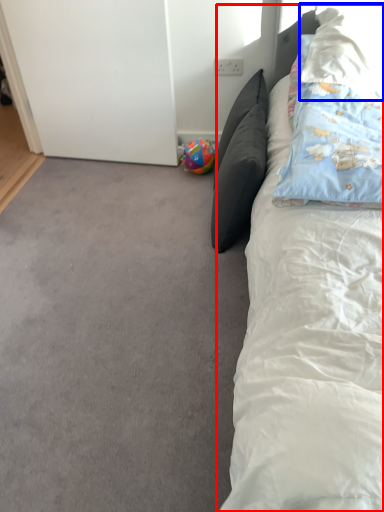
Question: Which object is further to the camera taking this photo, bed (highlighted by a red box) or pillow (highlighted by a blue box)?

Choices:
 (A) bed
 (B) pillow

Answer: (B)